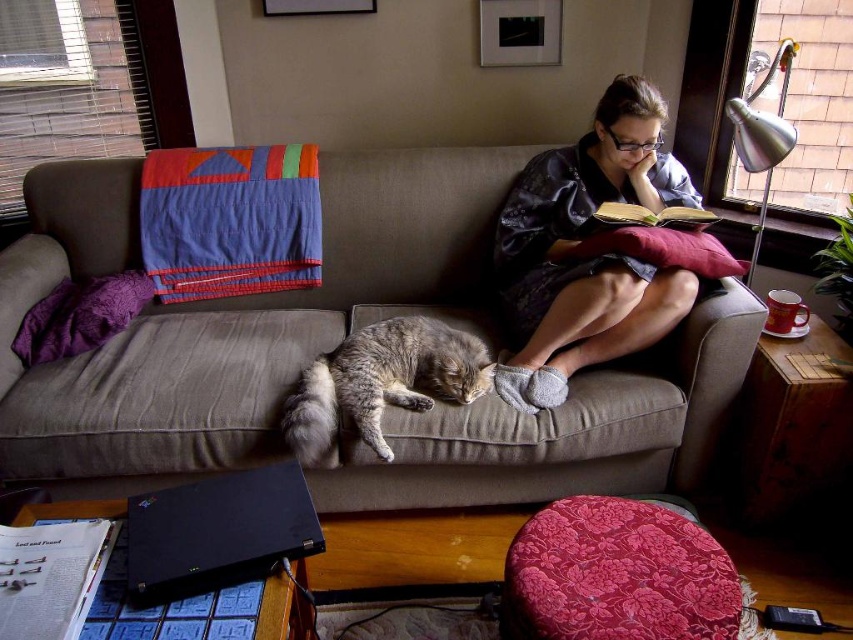
You are a delivery person who needs to place a small package on the sofa. The sofa has a coordinate system where the bottom left corner is the origin. The package must be placed at point (589, 259). However, there is a matte gray robe at upper right. Is the point on the sofa or on the matte gray robe at upper right?

The point (589, 259) is on the matte gray robe at upper right, so the package cannot be placed on the sofa at that coordinate because it is actually on the robe.

You are a delivery person who needs to place a small package on the sofa between the gray striped fur cat at center and the metallic silver lamp at upper right. Can you fit the package there?

The gray striped fur cat at center is wider than the metallic silver lamp at upper right, so there is enough space between them to place the small package.

You are a drone operator trying to deliver a small package to a specific location on the sofa. You have two points marked on the sofa for delivery. The first point is at coordinate point (650, 92) and the second is at point (483, 387). Which point is closer to you, the operator, so you can decide the best delivery route?

Point (650, 92) is further to the viewer than point (483, 387), so the second point is closer to you and would be easier to deliver to first.